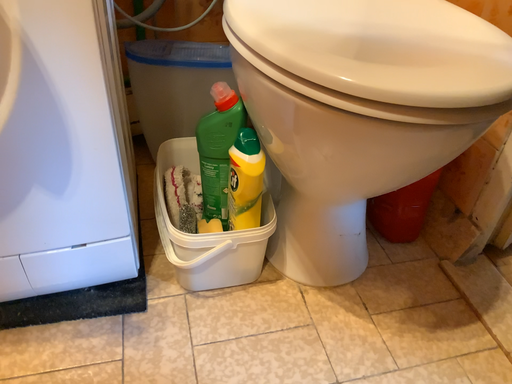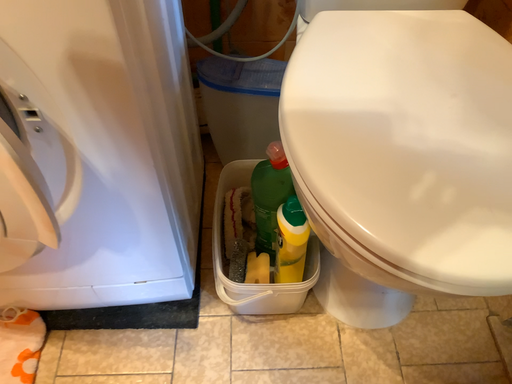
Question: How did the camera likely rotate when shooting the video?

Choices:
 (A) rotated left
 (B) rotated right

Answer: (A)